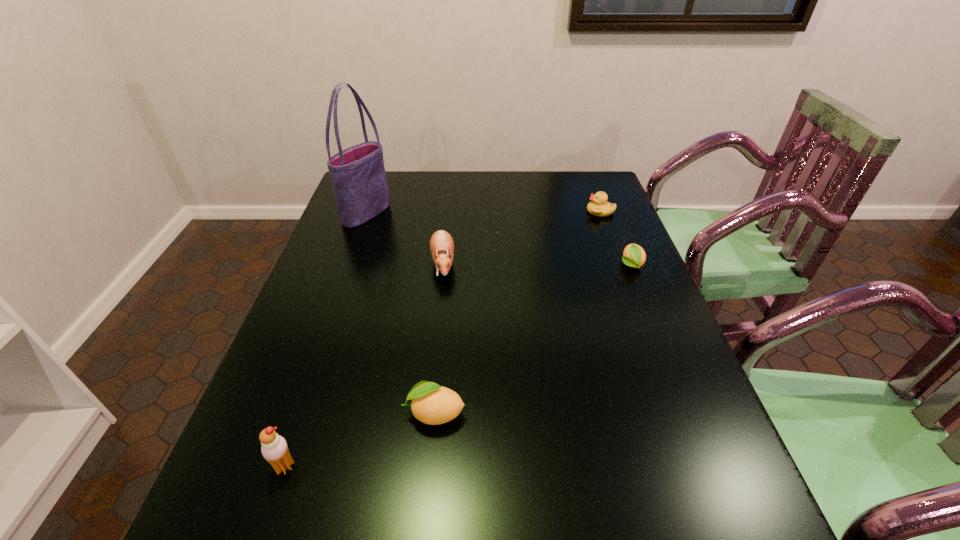
Identify the location of blank region between the right lemon and the nearest object. (458, 366).

The image size is (960, 540). I want to click on free point between the farther lemon and the nearer lemon, so click(533, 339).

Locate an element on the screen. The image size is (960, 540). vacant space that is in between the shorter lemon and the duckling is located at coordinates (615, 238).

This screenshot has width=960, height=540. I want to click on free space between the left lemon and the duckling, so click(517, 312).

Select which object is the closest to the left lemon. Please provide its 2D coordinates. Your answer should be formatted as a tuple, i.e. [(x, y)], where the tuple contains the x and y coordinates of a point satisfying the conditions above.

[(274, 449)]

The width and height of the screenshot is (960, 540). I want to click on object that is the fourth closest to the shorter lemon, so click(358, 176).

Where is `vacant region that satisfies the following two spatial constraints: 1. on the front-facing side of the duckling; 2. at the face of the hamster`? vacant region that satisfies the following two spatial constraints: 1. on the front-facing side of the duckling; 2. at the face of the hamster is located at coordinates (620, 264).

At what (x,y) coordinates should I click in order to perform the action: click on vacant space that satisfies the following two spatial constraints: 1. on the front-facing side of the duckling; 2. on the front side of the tallest object. Please return your answer as a coordinate pair (x, y). Looking at the image, I should click on (601, 213).

At what (x,y) coordinates should I click in order to perform the action: click on blank space that satisfies the following two spatial constraints: 1. on the front-facing side of the duckling; 2. at the face of the hamster. Please return your answer as a coordinate pair (x, y). This screenshot has width=960, height=540. Looking at the image, I should click on (620, 264).

At what (x,y) coordinates should I click in order to perform the action: click on free spot that satisfies the following two spatial constraints: 1. on the front-facing side of the duckling; 2. at the face of the hamster. Please return your answer as a coordinate pair (x, y). Looking at the image, I should click on (620, 264).